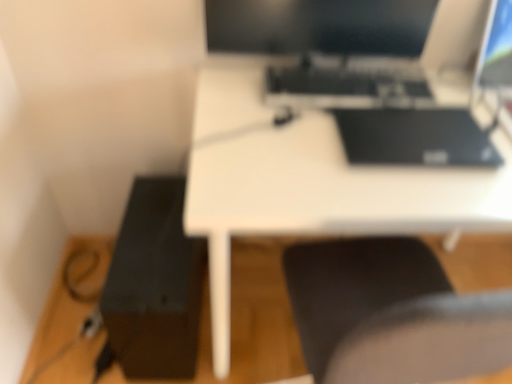
Question: Should I look upward or downward to see black matte printer at lower left?

Choices:
 (A) up
 (B) down

Answer: (B)

Question: Is matte black monitor at upper right positioned with its back to black matte keyboard at center?

Choices:
 (A) yes
 (B) no

Answer: (B)

Question: From a real-world perspective, is matte black monitor at upper right positioned under black matte keyboard at center based on gravity?

Choices:
 (A) yes
 (B) no

Answer: (B)

Question: Is matte black monitor at upper right bigger than black matte keyboard at center?

Choices:
 (A) no
 (B) yes

Answer: (B)

Question: Does matte black monitor at upper right come behind black matte keyboard at center?

Choices:
 (A) yes
 (B) no

Answer: (B)

Question: Is matte black monitor at upper right directly adjacent to black matte keyboard at center?

Choices:
 (A) no
 (B) yes

Answer: (A)

Question: Does matte black monitor at upper right turn towards black matte keyboard at center?

Choices:
 (A) yes
 (B) no

Answer: (B)

Question: Is black matte printer at lower left taller than black glossy monitor at upper center?

Choices:
 (A) yes
 (B) no

Answer: (A)

Question: Can you confirm if black matte printer at lower left is shorter than black glossy monitor at upper center?

Choices:
 (A) no
 (B) yes

Answer: (A)

Question: Can we say black matte printer at lower left lies outside black glossy monitor at upper center?

Choices:
 (A) no
 (B) yes

Answer: (B)

Question: From a real-world perspective, is black matte printer at lower left located beneath black glossy monitor at upper center?

Choices:
 (A) yes
 (B) no

Answer: (A)

Question: Can you confirm if black matte printer at lower left is thinner than black glossy monitor at upper center?

Choices:
 (A) no
 (B) yes

Answer: (A)

Question: Does black matte printer at lower left have a larger size compared to black glossy monitor at upper center?

Choices:
 (A) yes
 (B) no

Answer: (A)

Question: Is black matte keyboard at center shorter than white matte desk at center?

Choices:
 (A) yes
 (B) no

Answer: (A)